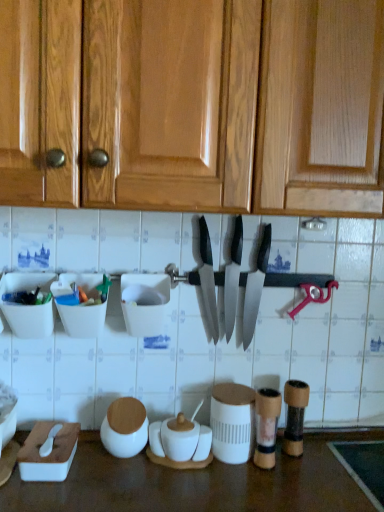
Question: Are white matte salt and pepper shakers at center and white plastic container at center, the fourth tableware viewed from the right, far apart?

Choices:
 (A) yes
 (B) no

Answer: (B)

Question: Is white matte salt and pepper shakers at center aimed at white plastic container at center, the fourth tableware viewed from the right?

Choices:
 (A) yes
 (B) no

Answer: (B)

Question: Would you say white plastic container at center, placed as the third tableware when sorted from left to right, is part of white matte salt and pepper shakers at center's contents?

Choices:
 (A) no
 (B) yes

Answer: (A)

Question: Is white matte salt and pepper shakers at center shorter than white plastic container at center, the fourth tableware viewed from the right?

Choices:
 (A) no
 (B) yes

Answer: (B)

Question: Is white matte salt and pepper shakers at center turned away from white plastic container at center, placed as the third tableware when sorted from left to right?

Choices:
 (A) no
 (B) yes

Answer: (A)

Question: Is the surface of white matte salt and pepper shakers at center in direct contact with white plastic container at center, the fourth tableware viewed from the right?

Choices:
 (A) no
 (B) yes

Answer: (A)

Question: Does white matte jar at lower center, marked as the 2th tableware in a left-to-right arrangement, have a greater height compared to white matte salt and pepper shakers at center?

Choices:
 (A) no
 (B) yes

Answer: (B)

Question: Can you confirm if white matte jar at lower center, marked as the 2th tableware in a left-to-right arrangement, is positioned to the left of white matte salt and pepper shakers at center?

Choices:
 (A) no
 (B) yes

Answer: (B)

Question: Is white matte jar at lower center, positioned as the 5th tableware in right-to-left order, in contact with white matte salt and pepper shakers at center?

Choices:
 (A) yes
 (B) no

Answer: (A)

Question: Does white matte jar at lower center, positioned as the 5th tableware in right-to-left order, have a greater width compared to white matte salt and pepper shakers at center?

Choices:
 (A) no
 (B) yes

Answer: (A)

Question: Is white matte jar at lower center, marked as the 2th tableware in a left-to-right arrangement, completely or partially outside of white matte salt and pepper shakers at center?

Choices:
 (A) yes
 (B) no

Answer: (A)

Question: Is white matte jar at lower center, marked as the 2th tableware in a left-to-right arrangement, thinner than white matte salt and pepper shakers at center?

Choices:
 (A) no
 (B) yes

Answer: (B)

Question: Would you say white matte jar at lower center, marked as the 2th tableware in a left-to-right arrangement, is outside translucent plastic container at left, the 6th tableware viewed from the right?

Choices:
 (A) yes
 (B) no

Answer: (A)